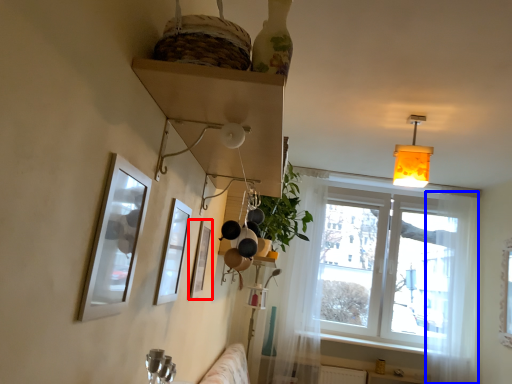
Question: Which of the following is the farthest to the observer, picture frame (highlighted by a red box) or curtain (highlighted by a blue box)?

Choices:
 (A) picture frame
 (B) curtain

Answer: (B)